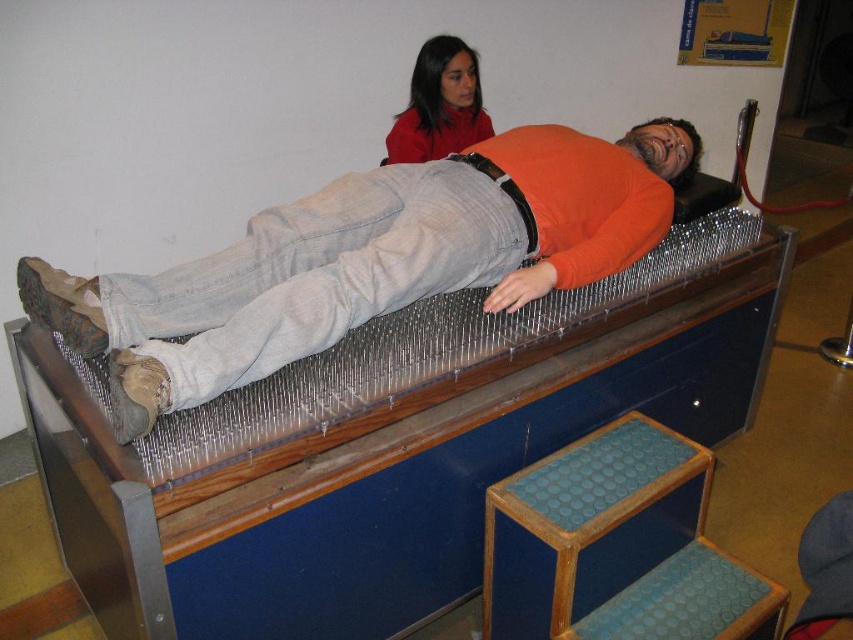
You are a visitor at the science museum and want to take a photo of the orange matte shirt at center and the blue rubberized step at lower right. Which object should you focus on first to ensure both are in the frame?

The orange matte shirt at center is closer to the viewer than the blue rubberized step at lower right, so you should focus on the orange matte shirt at center first to ensure both are in focus.

You are a museum visitor observing the bed of nails exhibit. You notice the orange matte shirt at center and the matte red sweater at upper center on the person. Based on their positions, which clothing item is closer to the ceiling?

The matte red sweater at upper center is closer to the ceiling because it is positioned above the orange matte shirt at center.